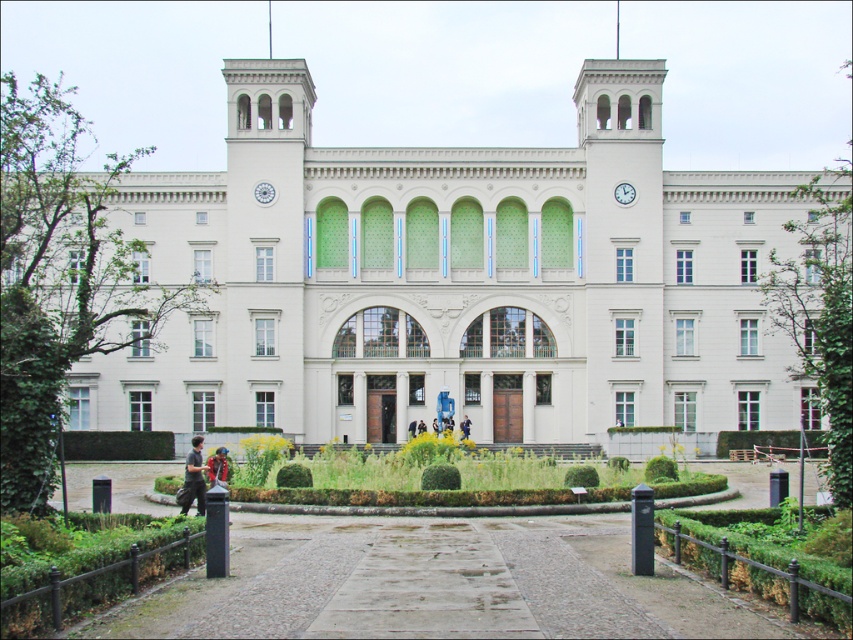
At what (x,y) coordinates should I click in order to perform the action: click on green leafy hedge at center. Please return your answer as a coordinate pair (x, y). The height and width of the screenshot is (640, 853). Looking at the image, I should click on (761, 557).

Does green leafy hedge at center appear over multicolored fabric at lower center?

No, green leafy hedge at center is not above multicolored fabric at lower center.

Is point (688, 509) closer to viewer compared to point (212, 465)?

Yes, it is.

Identify the location of green leafy hedge at center. (761, 557).

Consider the image. Can you confirm if dark gray fabric jacket at lower left is smaller than dark blue jeans at center?

No, dark gray fabric jacket at lower left is not smaller than dark blue jeans at center.

Does dark gray fabric jacket at lower left appear on the left side of dark blue jeans at center?

Correct, you'll find dark gray fabric jacket at lower left to the left of dark blue jeans at center.

Is point (196, 468) closer to camera compared to point (465, 436)?

Yes, it is in front of point (465, 436).

The image size is (853, 640). Identify the location of dark gray fabric jacket at lower left. (194, 477).

Is point (259, 72) behind point (224, 477)?

Yes, point (259, 72) is behind point (224, 477).

Between white stone building at center and multicolored fabric at lower center, which one has less height?

Standing shorter between the two is multicolored fabric at lower center.

Is point (171, 243) farther from camera compared to point (225, 456)?

Yes.

Identify the location of white stone building at center. This screenshot has width=853, height=640. (456, 282).